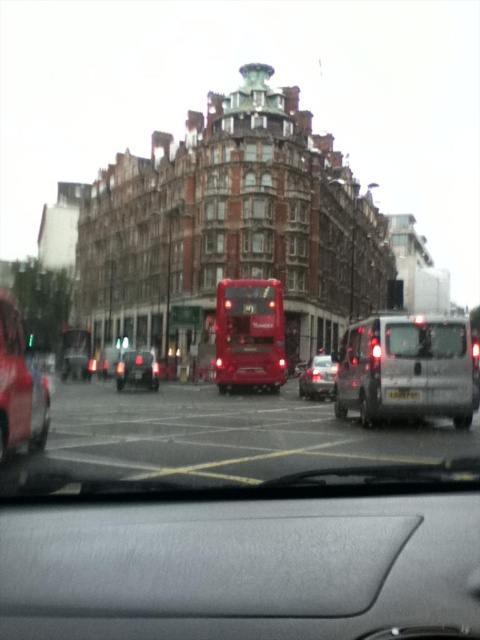
From the picture: Between shiny black car at center and white plastic license plate at center, which one has more height?

shiny black car at center is taller.

Between shiny black car at center and white plastic license plate at center, which one is positioned higher?

white plastic license plate at center

What are the coordinates of `shiny black car at center` in the screenshot? It's located at (x=136, y=369).

Which is behind, point (21, 388) or point (408, 390)?

The point (408, 390) is behind.

Is metallic red car at left wider than white plastic license plate at center?

No.

Between point (28, 364) and point (398, 388), which one is positioned in front?

Point (28, 364) is in front.

The image size is (480, 640). What are the coordinates of `metallic red car at left` in the screenshot? It's located at (20, 387).

Is point (380, 381) farther from camera compared to point (440, 340)?

Yes, it is behind point (440, 340).

Which of these two, silver metallic van at right or transparent glass windshield at center, stands taller?

With more height is silver metallic van at right.

The image size is (480, 640). What are the coordinates of `silver metallic van at right` in the screenshot? It's located at (407, 369).